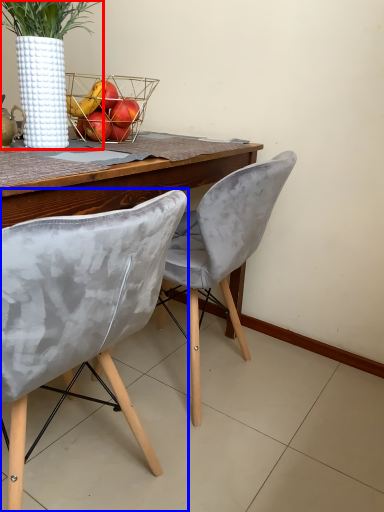
Question: Which object is further to the camera taking this photo, houseplant (highlighted by a red box) or chair (highlighted by a blue box)?

Choices:
 (A) houseplant
 (B) chair

Answer: (A)